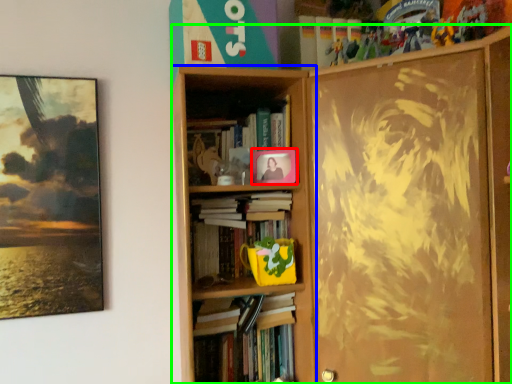
Question: Which object is the farthest from picture frame (highlighted by a red box)? Choose among these: bookcase (highlighted by a blue box) or bookcase (highlighted by a green box).

Choices:
 (A) bookcase
 (B) bookcase

Answer: (B)